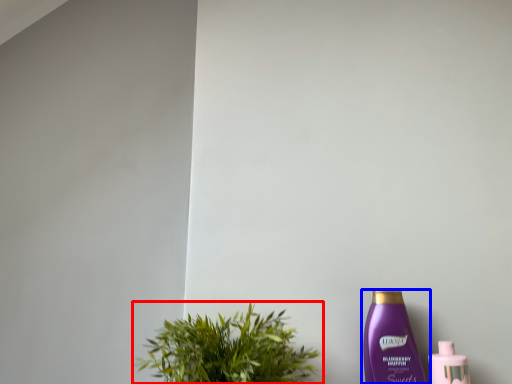
Question: Which object is further to the camera taking this photo, houseplant (highlighted by a red box) or bottle (highlighted by a blue box)?

Choices:
 (A) houseplant
 (B) bottle

Answer: (B)